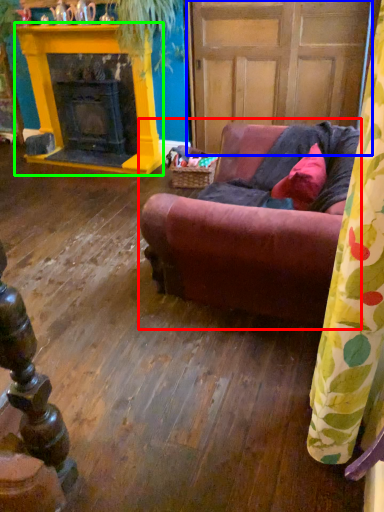
Question: Which object is positioned closest to studio couch (highlighted by a red box)? Select from door (highlighted by a blue box) and fireplace (highlighted by a green box).

Choices:
 (A) door
 (B) fireplace

Answer: (A)